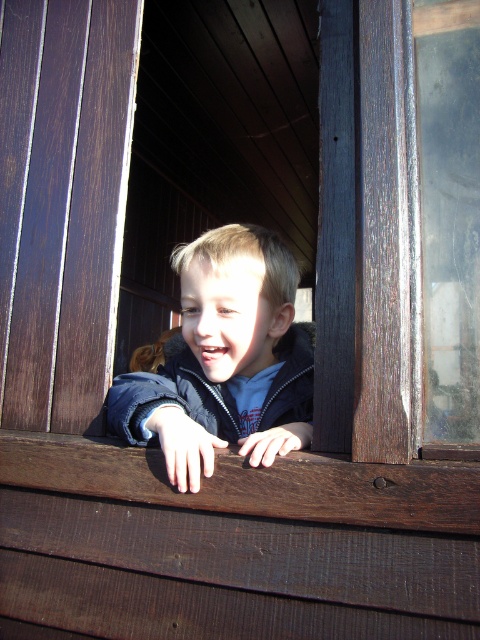
Which is behind, point (208, 292) or point (145, 433)?

The point (208, 292) is more distant.

This screenshot has height=640, width=480. I want to click on matte blue jacket at center, so click(x=225, y=360).

This screenshot has width=480, height=640. Identify the location of matte blue jacket at center. (225, 360).

Which is in front, point (142, 374) or point (452, 225)?

Point (452, 225) is in front.

Is point (233, 253) positioned before point (442, 97)?

No.

Find the location of `matte blue jacket at center`. matte blue jacket at center is located at coordinates (x=225, y=360).

Is point (470, 205) in front of point (115, 392)?

Yes, point (470, 205) is closer to viewer.

The height and width of the screenshot is (640, 480). In order to click on transparent glass window at right in this screenshot , I will do `click(447, 212)`.